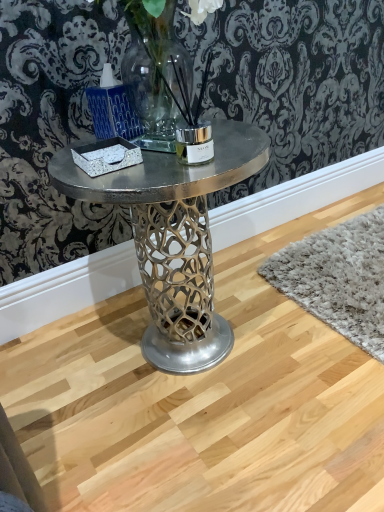
Locate an element on the screen. free space in front of metallic silver table at center is located at coordinates (230, 377).